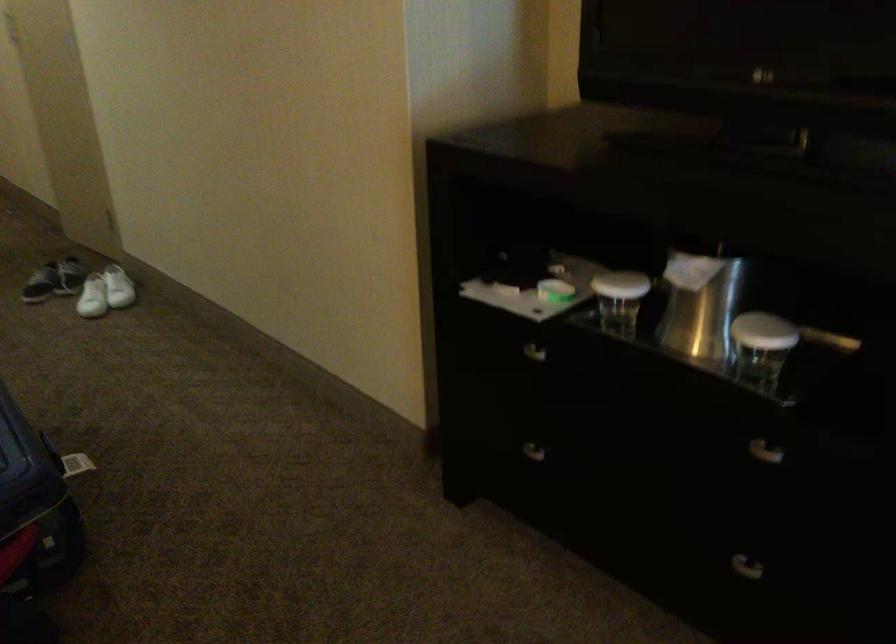
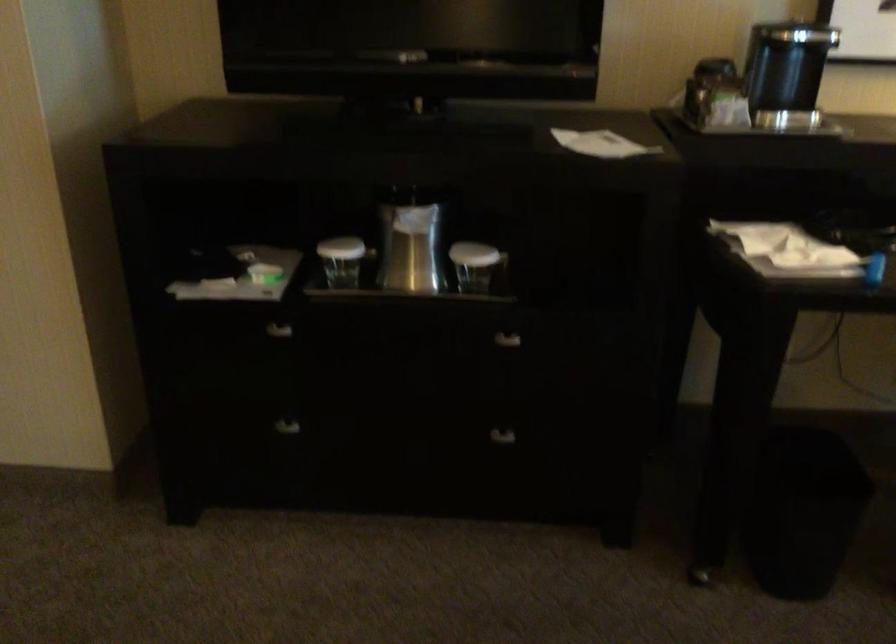
Locate, in the second image, the point that corresponds to (710,290) in the first image.

(410, 240)